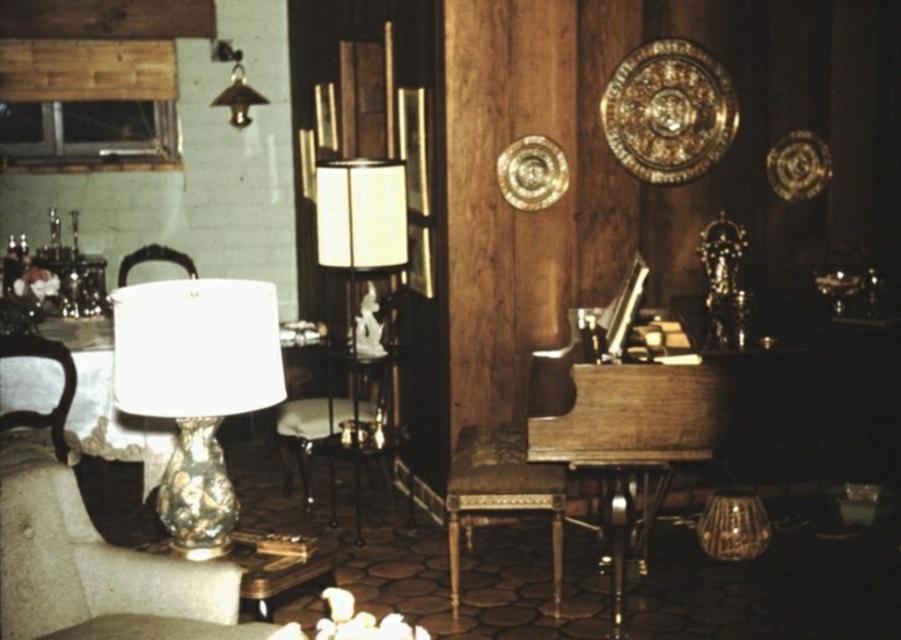
Question: Which of the following is the closest to the observer?

Choices:
 (A) (150, 540)
 (B) (349, 248)
 (C) (472, 440)

Answer: (C)

Question: Can you confirm if gold-patterned glass lamp at left is positioned below wooden armchair at left?

Choices:
 (A) yes
 (B) no

Answer: (A)

Question: Does shiny metallic table at lower left appear on the left side of gold metallic lampshade at upper left?

Choices:
 (A) yes
 (B) no

Answer: (B)

Question: Can you confirm if gold-patterned fabric armchair at left is positioned above shiny metallic table at lower left?

Choices:
 (A) yes
 (B) no

Answer: (A)

Question: Which point appears closest to the camera in this image?

Choices:
 (A) (111, 385)
 (B) (217, 102)
 (C) (214, 323)
 (D) (479, 504)

Answer: (C)

Question: Which point is farther to the camera?

Choices:
 (A) gold metallic lampshade at upper left
 (B) gold-patterned fabric armchair at left
 (C) matte glass lamp at center

Answer: (A)